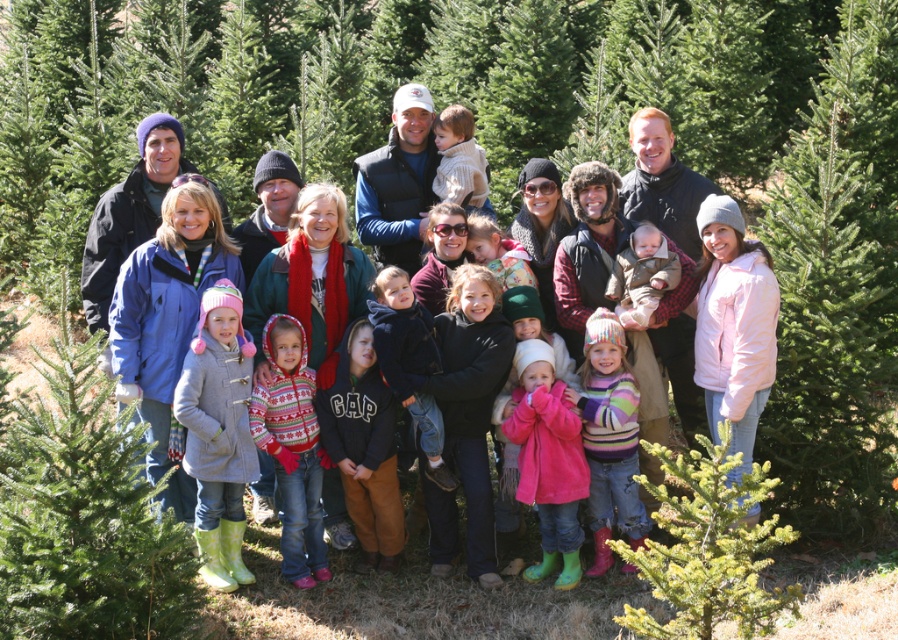
Is point (137, 484) behind point (553, 362)?

No, it is not.

Who is shorter, green textured christmas tree at lower left or pink fleece jacket at center?

green textured christmas tree at lower left is shorter.

Who is more forward, (131, 602) or (507, 426)?

Positioned in front is point (131, 602).

The width and height of the screenshot is (898, 640). I want to click on green textured christmas tree at lower left, so click(x=84, y=515).

Who is shorter, pink fleece jacket at center or striped sweater at center?

Standing shorter between the two is pink fleece jacket at center.

Based on the photo, does pink fleece jacket at center come behind striped sweater at center?

That is False.

I want to click on pink fleece jacket at center, so click(548, 460).

Is green matte fir tree at lower right shorter than matte brown baby at center?

No.

Between green matte fir tree at lower right and matte brown baby at center, which one has more height?

green matte fir tree at lower right

Which is in front, point (678, 545) or point (650, 280)?

Point (678, 545) is in front.

I want to click on green matte fir tree at lower right, so click(710, 547).